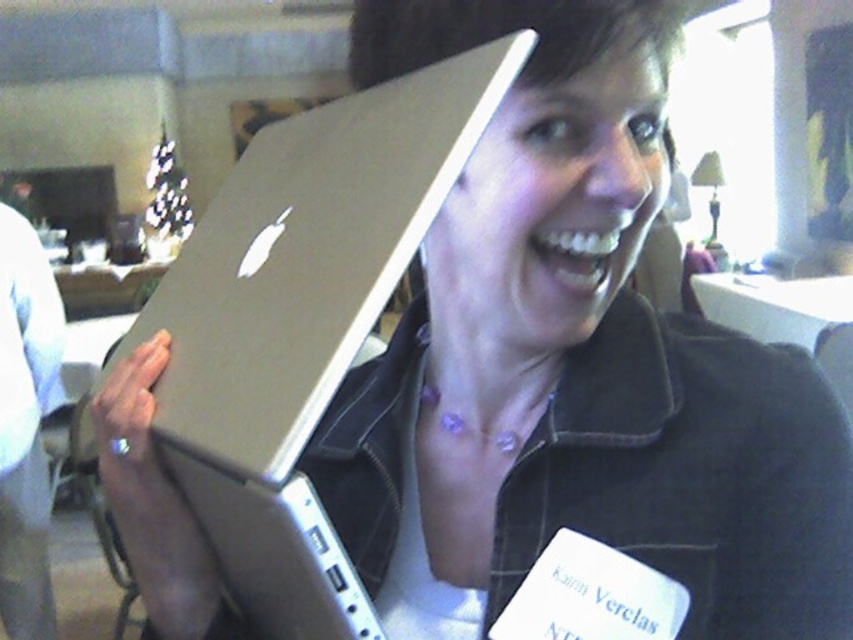
Question: Which point is farther to the camera?

Choices:
 (A) (325, 326)
 (B) (16, 296)

Answer: (B)

Question: Which point is farther to the camera?

Choices:
 (A) click(39, 516)
 (B) click(351, 136)

Answer: (A)

Question: Is silver metallic laptop at center thinner than brushed metal laptop at left?

Choices:
 (A) yes
 (B) no

Answer: (A)

Question: Is silver metallic laptop at center below brushed metal laptop at left?

Choices:
 (A) yes
 (B) no

Answer: (B)

Question: Which of the following is the closest to the observer?

Choices:
 (A) brushed metal laptop at left
 (B) silver metallic laptop at center

Answer: (B)

Question: Does silver metallic laptop at center have a greater width compared to brushed metal laptop at left?

Choices:
 (A) yes
 (B) no

Answer: (B)